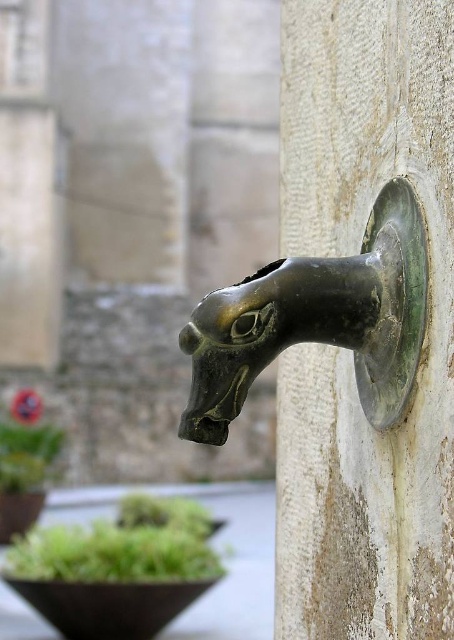
Question: Does bronze/rough horse head at center have a greater width compared to green leafy plant at lower left?

Choices:
 (A) no
 (B) yes

Answer: (A)

Question: Which point is closer to the camera?

Choices:
 (A) (413, 588)
 (B) (13, 413)

Answer: (A)

Question: Estimate the real-world distances between objects in this image. Which object is closer to the bronze/brass horse head at center?

Choices:
 (A) green leafy plant at lower left
 (B) bronze/rough horse head at center

Answer: (B)

Question: Is bronze/brass horse head at center above green leafy plant at lower left?

Choices:
 (A) no
 (B) yes

Answer: (B)

Question: Based on their relative distances, which object is farther from the green leafy plant at lower left?

Choices:
 (A) bronze/brass horse head at center
 (B) bronze/rough horse head at center

Answer: (A)

Question: Is bronze/brass horse head at center wider than green leafy plant at lower left?

Choices:
 (A) no
 (B) yes

Answer: (A)